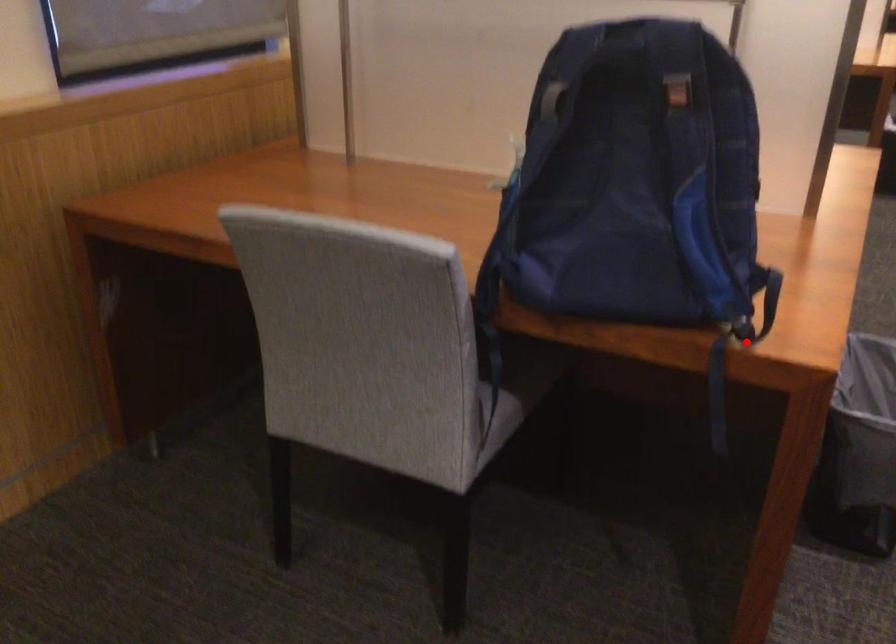
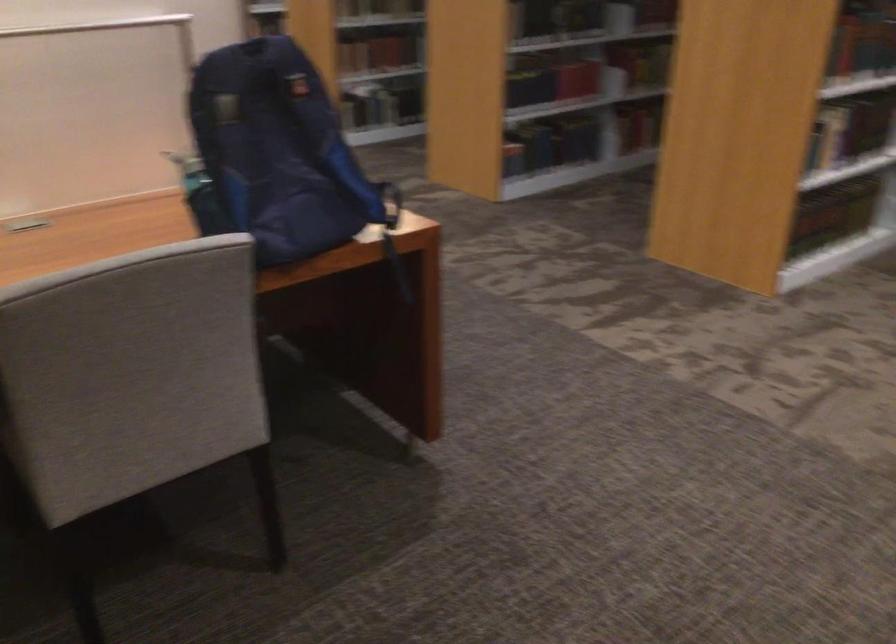
Question: I am providing you with two images of the same scene from different viewpoints. Image1 has a red point marked. In image2, the corresponding 3D location appears at what relative position? Reply with the corresponding letter.

Choices:
 (A) Closer
 (B) Farther

Answer: (B)